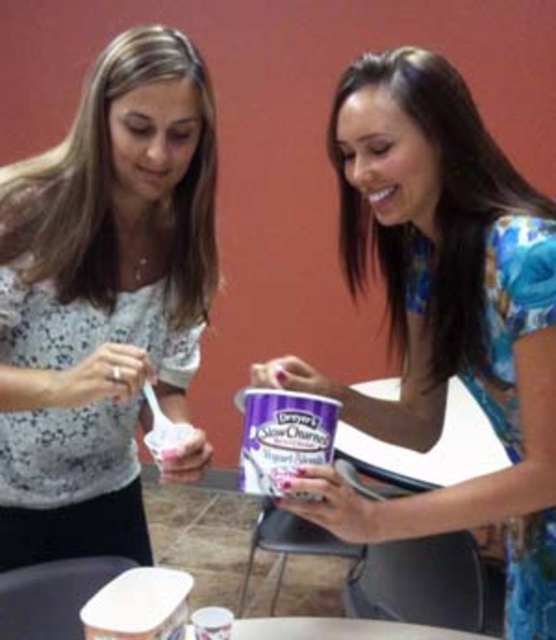
Who is lower down, white lace blouse at left or floral dress at center?

floral dress at center is below.

At what (x,y) coordinates should I click in order to perform the action: click on white lace blouse at left. Please return your answer as a coordinate pair (x, y). The width and height of the screenshot is (556, 640). Looking at the image, I should click on (103, 298).

The width and height of the screenshot is (556, 640). What are the coordinates of `white lace blouse at left` in the screenshot? It's located at click(103, 298).